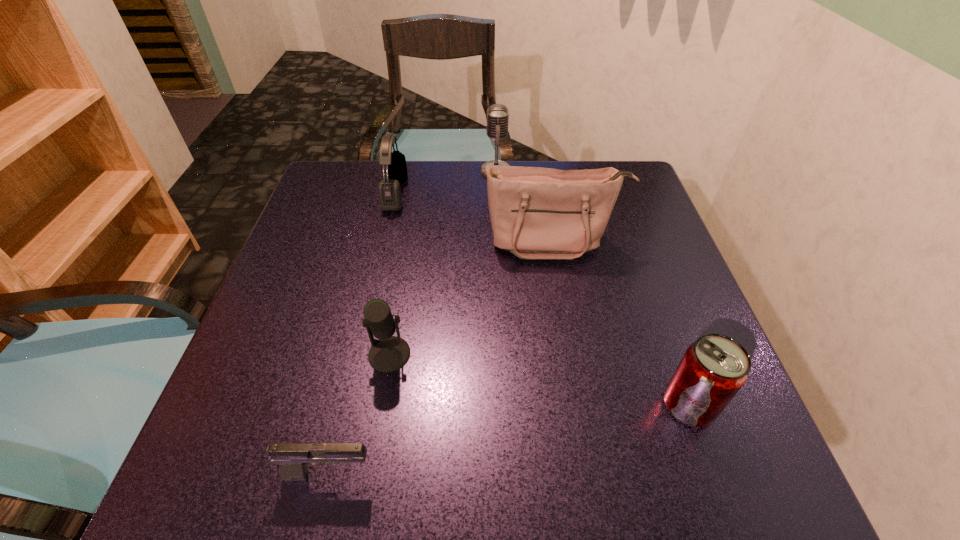
I want to click on vacant area between the nearest object and the fourth nearest object, so click(442, 357).

Identify the location of unoccupied position between the second nearest object and the taller microphone. (592, 288).

The image size is (960, 540). I want to click on vacant area that lies between the shortest object and the third farthest object, so click(442, 357).

The width and height of the screenshot is (960, 540). I want to click on free spot between the nearer microphone and the farther microphone, so click(x=443, y=262).

At what (x,y) coordinates should I click in order to perform the action: click on free space that is in between the pop soda and the headset. Please return your answer as a coordinate pair (x, y). Looking at the image, I should click on (542, 299).

Identify the location of empty space between the farther microphone and the shortest object. (413, 322).

Identify the location of empty space between the shortest object and the shoulder bag. (442, 357).

Point out which object is positioned as the nearest to the shorter microphone. Please provide its 2D coordinates. Your answer should be formatted as a tuple, i.e. [(x, y)], where the tuple contains the x and y coordinates of a point satisfying the conditions above.

[(293, 458)]

Identify which object is the fourth nearest to the headset. Please provide its 2D coordinates. Your answer should be formatted as a tuple, i.e. [(x, y)], where the tuple contains the x and y coordinates of a point satisfying the conditions above.

[(293, 458)]

Find the location of a particular element. Image resolution: width=960 pixels, height=540 pixels. vacant space that satisfies the following two spatial constraints: 1. on the front side of the taller microphone; 2. on the headband of the headset is located at coordinates (497, 193).